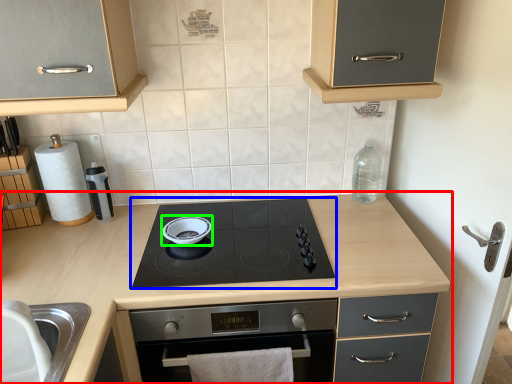
Question: Which is farther away from countertop (highlighted by a red box)? gas stove (highlighted by a blue box) or soup bowl (highlighted by a green box)?

Choices:
 (A) gas stove
 (B) soup bowl

Answer: (B)